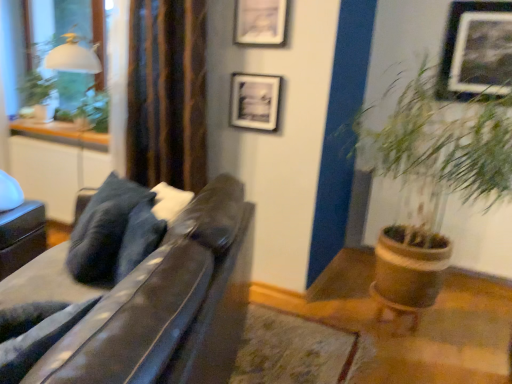
Question: Can you confirm if matte black picture frame at upper center, which is the 3th picture frame from right to left, is wider than green leafy plant at upper left?

Choices:
 (A) no
 (B) yes

Answer: (A)

Question: Does matte black picture frame at upper center, which is the 3th picture frame from right to left, have a lesser width compared to green leafy plant at upper left?

Choices:
 (A) no
 (B) yes

Answer: (B)

Question: Are matte black picture frame at upper center, placed as the first picture frame when sorted from left to right, and green leafy plant at upper left making contact?

Choices:
 (A) no
 (B) yes

Answer: (A)

Question: From the image's perspective, is matte black picture frame at upper center, placed as the first picture frame when sorted from left to right, on top of green leafy plant at upper left?

Choices:
 (A) yes
 (B) no

Answer: (B)

Question: Considering the relative sizes of matte black picture frame at upper center, placed as the first picture frame when sorted from left to right, and green leafy plant at upper left in the image provided, is matte black picture frame at upper center, placed as the first picture frame when sorted from left to right, smaller than green leafy plant at upper left?

Choices:
 (A) yes
 (B) no

Answer: (A)

Question: From the image's perspective, is matte black picture frame at upper center, which is the 3th picture frame from right to left, below green leafy plant at upper left?

Choices:
 (A) yes
 (B) no

Answer: (A)

Question: Is green leafy plant at upper left turned away from matte black picture frame at upper center, marked as the 2th picture frame in a right-to-left arrangement?

Choices:
 (A) yes
 (B) no

Answer: (B)

Question: Are green leafy plant at upper left and matte black picture frame at upper center, marked as the 2th picture frame in a right-to-left arrangement, located far from each other?

Choices:
 (A) yes
 (B) no

Answer: (A)

Question: From a real-world perspective, is green leafy plant at upper left on matte black picture frame at upper center, marked as the 2th picture frame in a right-to-left arrangement?

Choices:
 (A) yes
 (B) no

Answer: (B)

Question: Can matte black picture frame at upper center, which appears as the second picture frame when viewed from the left, be found inside green leafy plant at upper left?

Choices:
 (A) yes
 (B) no

Answer: (B)

Question: Does green leafy plant at upper left have a smaller size compared to matte black picture frame at upper center, marked as the 2th picture frame in a right-to-left arrangement?

Choices:
 (A) no
 (B) yes

Answer: (A)

Question: Does green leafy plant at upper left have a larger size compared to matte black picture frame at upper center, marked as the 2th picture frame in a right-to-left arrangement?

Choices:
 (A) no
 (B) yes

Answer: (B)

Question: Considering the relative sizes of matte black picture frame at upper center, marked as the 2th picture frame in a right-to-left arrangement, and green leafy plant at right in the image provided, is matte black picture frame at upper center, marked as the 2th picture frame in a right-to-left arrangement, taller than green leafy plant at right?

Choices:
 (A) yes
 (B) no

Answer: (B)